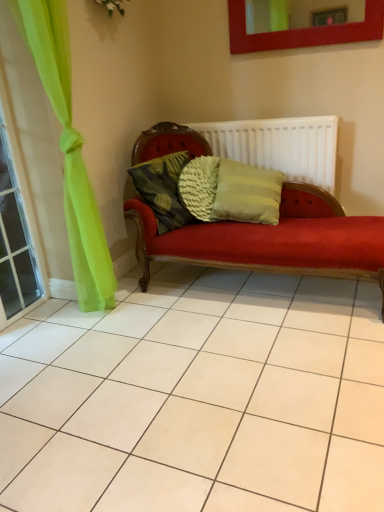
Question: Is the depth of matte red picture frame at upper center less than that of woven fabric pillow at center?

Choices:
 (A) yes
 (B) no

Answer: (A)

Question: Does matte red picture frame at upper center appear on the left side of woven fabric pillow at center?

Choices:
 (A) no
 (B) yes

Answer: (A)

Question: From a real-world perspective, is matte red picture frame at upper center located higher than woven fabric pillow at center?

Choices:
 (A) no
 (B) yes

Answer: (B)

Question: Could you tell me if matte red picture frame at upper center is facing woven fabric pillow at center?

Choices:
 (A) no
 (B) yes

Answer: (A)

Question: Would you say matte red picture frame at upper center contains woven fabric pillow at center?

Choices:
 (A) yes
 (B) no

Answer: (B)

Question: Is matte red picture frame at upper center next to woven fabric pillow at center?

Choices:
 (A) no
 (B) yes

Answer: (A)

Question: Is woven fabric pillow at center bigger than white ribbed radiator at center?

Choices:
 (A) no
 (B) yes

Answer: (A)

Question: Is woven fabric pillow at center located outside white ribbed radiator at center?

Choices:
 (A) yes
 (B) no

Answer: (A)

Question: Is woven fabric pillow at center shorter than white ribbed radiator at center?

Choices:
 (A) no
 (B) yes

Answer: (B)

Question: From the image's perspective, is woven fabric pillow at center under white ribbed radiator at center?

Choices:
 (A) yes
 (B) no

Answer: (A)

Question: Does woven fabric pillow at center come in front of white ribbed radiator at center?

Choices:
 (A) yes
 (B) no

Answer: (A)

Question: Considering the relative positions of woven fabric pillow at center and white ribbed radiator at center in the image provided, is woven fabric pillow at center to the left of white ribbed radiator at center from the viewer's perspective?

Choices:
 (A) yes
 (B) no

Answer: (A)

Question: Can you confirm if white ribbed radiator at center is thinner than green sheer curtain at left?

Choices:
 (A) yes
 (B) no

Answer: (B)